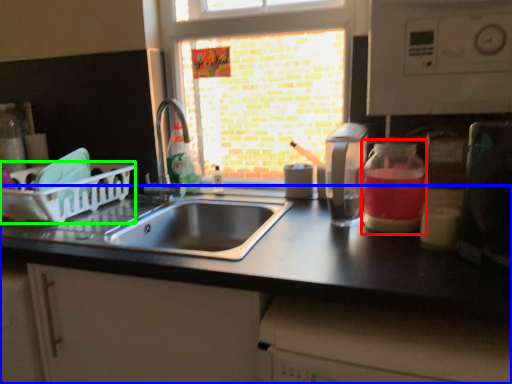
Question: Which is farther away from glass jar (highlighted by a red box)? countertop (highlighted by a blue box) or basket (highlighted by a green box)?

Choices:
 (A) countertop
 (B) basket

Answer: (B)